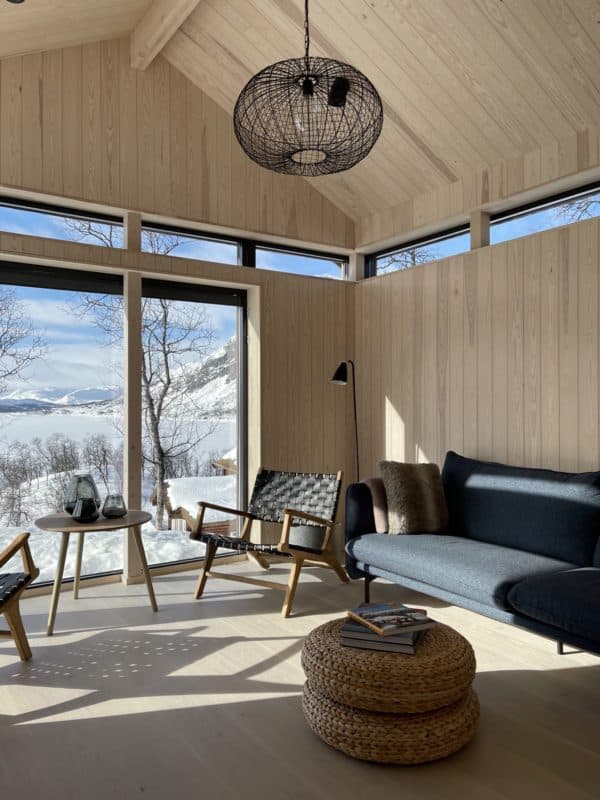
Where is `couch`? The width and height of the screenshot is (600, 800). couch is located at coordinates (452, 552).